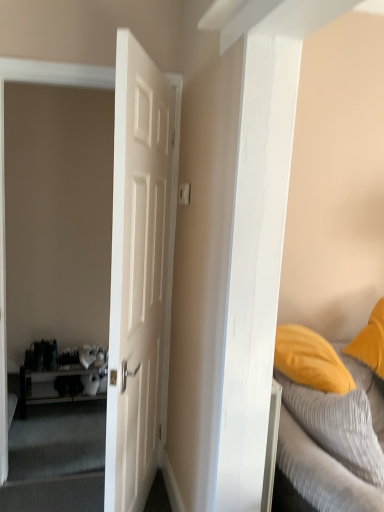
Question: Is white matte door at center behind wooden shelf at left?

Choices:
 (A) no
 (B) yes

Answer: (A)

Question: Does white matte door at center have a larger size compared to wooden shelf at left?

Choices:
 (A) yes
 (B) no

Answer: (A)

Question: Is white matte door at center far from wooden shelf at left?

Choices:
 (A) no
 (B) yes

Answer: (B)

Question: From the image's perspective, does white matte door at center appear lower than wooden shelf at left?

Choices:
 (A) yes
 (B) no

Answer: (B)

Question: Considering the relative sizes of white matte door at center and wooden shelf at left in the image provided, is white matte door at center taller than wooden shelf at left?

Choices:
 (A) yes
 (B) no

Answer: (A)

Question: Is white matte door at center looking in the opposite direction of wooden shelf at left?

Choices:
 (A) yes
 (B) no

Answer: (B)

Question: Considering the relative positions of wooden shelf at left and textured gray bed at right in the image provided, is wooden shelf at left behind textured gray bed at right?

Choices:
 (A) yes
 (B) no

Answer: (A)

Question: Considering the relative positions of wooden shelf at left and textured gray bed at right in the image provided, is wooden shelf at left to the left of textured gray bed at right from the viewer's perspective?

Choices:
 (A) yes
 (B) no

Answer: (A)

Question: Is wooden shelf at left surrounding textured gray bed at right?

Choices:
 (A) yes
 (B) no

Answer: (B)

Question: Does wooden shelf at left have a lesser height compared to textured gray bed at right?

Choices:
 (A) no
 (B) yes

Answer: (B)

Question: Is textured gray bed at right at the back of wooden shelf at left?

Choices:
 (A) yes
 (B) no

Answer: (B)

Question: Does wooden shelf at left have a greater height compared to textured gray bed at right?

Choices:
 (A) yes
 (B) no

Answer: (B)

Question: Is textured gray bed at right thinner than white matte door at center?

Choices:
 (A) yes
 (B) no

Answer: (B)